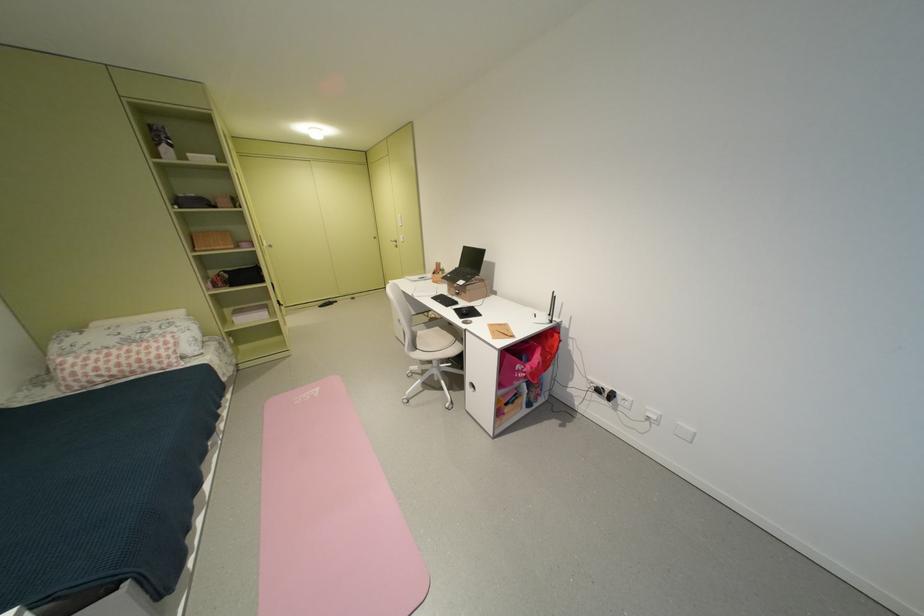
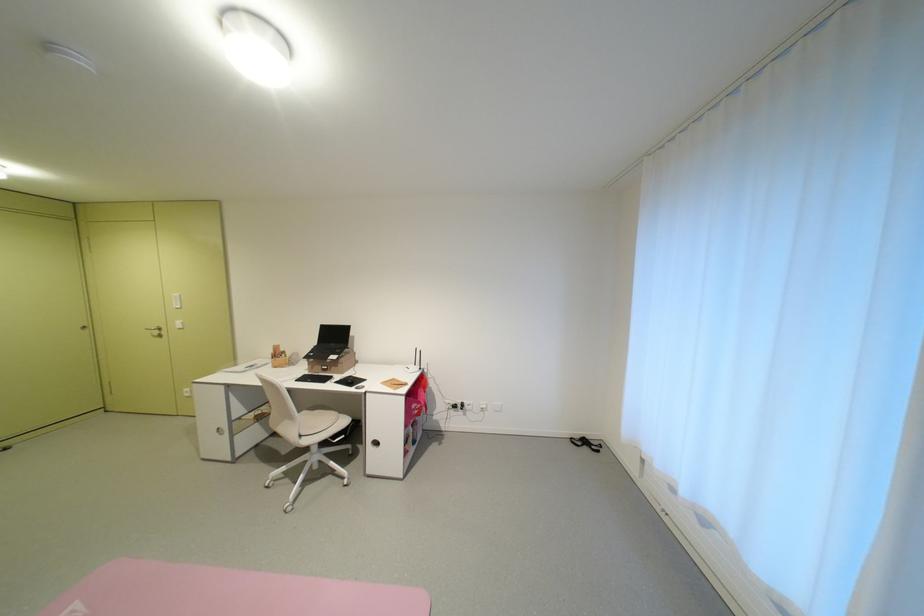
Locate, in the second image, the point that corresponds to (400,243) in the first image.

(156, 331)